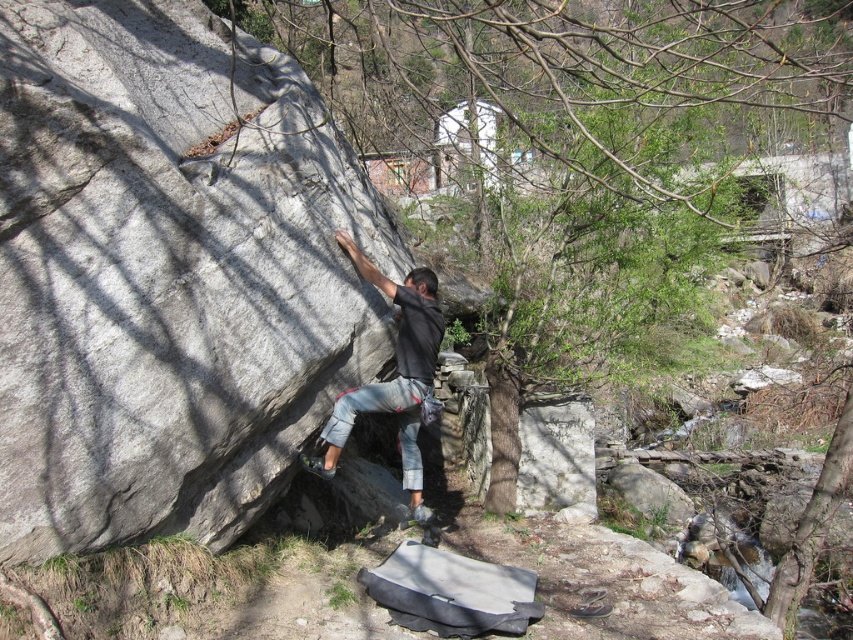
Question: Can you confirm if gray rough rock at center is smaller than dark gray stone climbing gear at center?

Choices:
 (A) yes
 (B) no

Answer: (B)

Question: Which point appears closest to the camera in this image?

Choices:
 (A) (308, 458)
 (B) (250, 182)

Answer: (B)

Question: Where is gray rough rock at center located in relation to dark gray stone climbing gear at center in the image?

Choices:
 (A) right
 (B) left

Answer: (B)

Question: Is gray rough rock at center closer to camera compared to dark gray stone climbing gear at center?

Choices:
 (A) no
 (B) yes

Answer: (B)